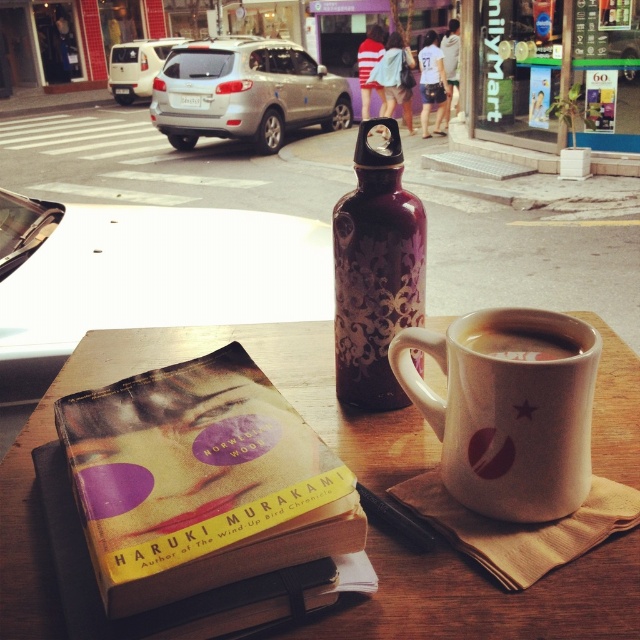
Question: Among these objects, which one is farthest from the camera?

Choices:
 (A) hardcover book at center
 (B) purple metallic water bottle at center

Answer: (B)

Question: Can you confirm if white matte mug at upper center is positioned to the right of white glossy mug at upper center?

Choices:
 (A) no
 (B) yes

Answer: (A)

Question: Among these points, which one is farthest from the camera?

Choices:
 (A) (472, 340)
 (B) (433, 620)
 (C) (509, 316)

Answer: (C)

Question: Is hardcover book at center positioned before white matte mug at upper center?

Choices:
 (A) yes
 (B) no

Answer: (A)

Question: Does hardcover book at center appear under white matte mug at upper center?

Choices:
 (A) yes
 (B) no

Answer: (A)

Question: Which point is closer to the camera taking this photo?

Choices:
 (A) (355, 211)
 (B) (518, 420)

Answer: (B)